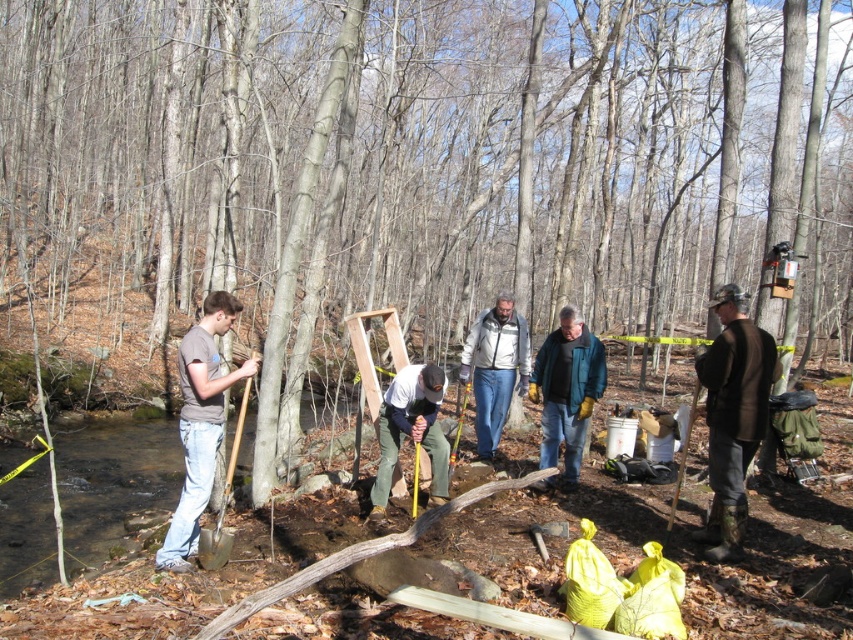
Question: In this image, where is brown leather jacket at right located relative to teal jacket at center?

Choices:
 (A) below
 (B) above

Answer: (B)

Question: Is the position of teal jacket at center more distant than that of matte white shirt at center?

Choices:
 (A) no
 (B) yes

Answer: (B)

Question: Which object appears closest to the camera in this image?

Choices:
 (A) brown leather jacket at right
 (B) wooden shovel at left

Answer: (A)

Question: Which point appears farthest from the camera in this image?

Choices:
 (A) (579, 328)
 (B) (486, 330)
 (C) (393, 440)

Answer: (B)

Question: Is brown leather jacket at right below matte white shirt at center?

Choices:
 (A) yes
 (B) no

Answer: (B)

Question: Which object is the farthest from the matte white shirt at center?

Choices:
 (A) brown cotton t-shirt at left
 (B) wooden shovel at left
 (C) light gray jacket at center
 (D) teal jacket at center

Answer: (C)